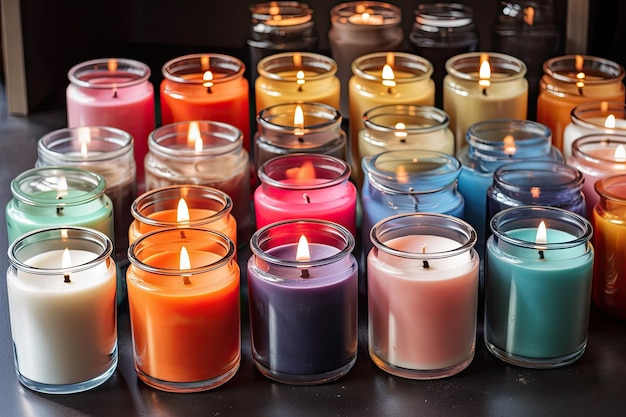
The image size is (626, 417). What are the coordinates of `top row of candles` in the screenshot? It's located at (118, 82), (188, 80), (300, 72), (390, 71), (483, 82), (568, 75).